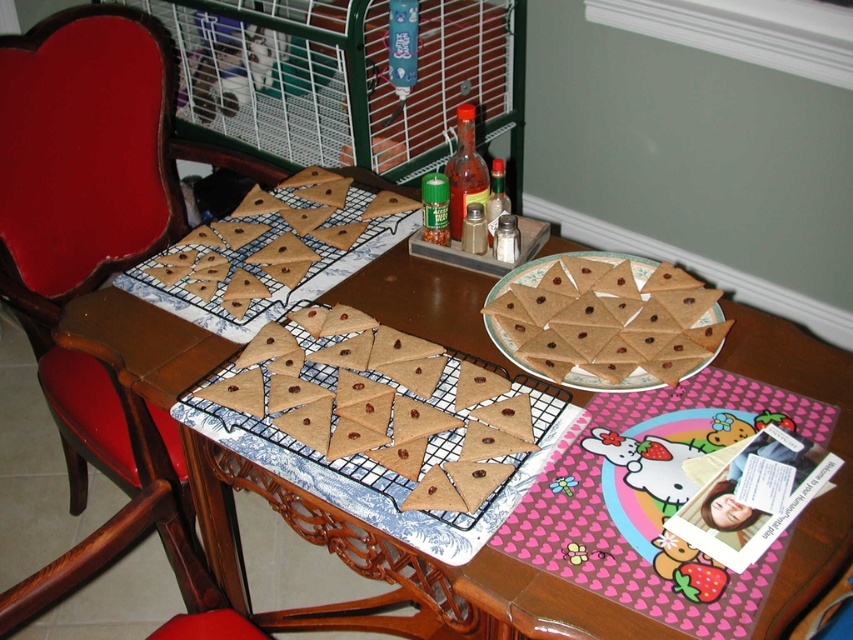
Between point (54, 380) and point (589, 301), which one is positioned behind?

Point (54, 380)

Can you confirm if wooden chair at left is taller than brown matte triangle crackers at center?

Indeed, wooden chair at left has a greater height compared to brown matte triangle crackers at center.

Between point (134, 65) and point (525, 285), which one is positioned in front?

Positioned in front is point (525, 285).

You are a GUI agent. You are given a task and a screenshot of the screen. Output one action in this format:
    pyautogui.click(x=<x>, y=<y>)
    Task: Click on the wooden chair at left
    
    Given the screenshot: What is the action you would take?
    pyautogui.click(x=83, y=198)

Is brown matte triangle cookies at center further to camera compared to brown matte triangle crackers at center?

Yes, it is.

Does point (160, 276) come behind point (633, 301)?

That is True.

Between point (381, 218) and point (552, 301), which one is positioned in front?

Positioned in front is point (552, 301).

You are a GUI agent. You are given a task and a screenshot of the screen. Output one action in this format:
    pyautogui.click(x=<x>, y=<y>)
    Task: Click on the brown matte triangle cookies at center
    The width and height of the screenshot is (853, 640).
    Given the screenshot: What is the action you would take?
    pyautogui.click(x=273, y=252)

In the scene shown: Who is positioned more to the left, brown matte cookies at center or brown matte triangle cookies at center?

brown matte triangle cookies at center is more to the left.

Where is `brown matte cookies at center`? This screenshot has height=640, width=853. brown matte cookies at center is located at coordinates (831, 440).

Identify the location of brown matte cookies at center. (831, 440).